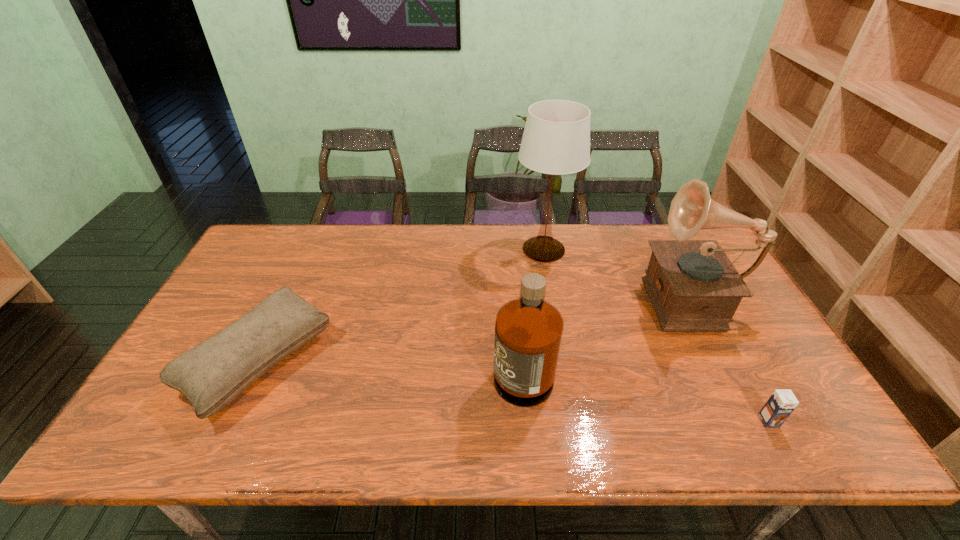
The image size is (960, 540). What are the coordinates of `chocolate milk that is at the right edge` in the screenshot? It's located at (780, 405).

This screenshot has width=960, height=540. I want to click on object located in the near left corner section of the desktop, so click(212, 374).

Locate an element on the screen. object positioned at the far right corner is located at coordinates (693, 286).

The width and height of the screenshot is (960, 540). I want to click on object present at the near right corner, so click(x=780, y=405).

This screenshot has height=540, width=960. In the image, there is a desktop. In order to click on vacant region at the far edge in this screenshot , I will do `click(639, 224)`.

Identify the location of vacant area at the near edge of the desktop. (705, 425).

Find the location of `blank space at the left edge`. blank space at the left edge is located at coordinates (217, 299).

In the image, there is a desktop. Where is `vacant space at the right edge`? Image resolution: width=960 pixels, height=540 pixels. vacant space at the right edge is located at coordinates (751, 330).

In the image, there is a desktop. Identify the location of vacant space at the far left corner. The height and width of the screenshot is (540, 960). (286, 241).

In the image, there is a desktop. What are the coordinates of `free space at the near left corner` in the screenshot? It's located at (120, 449).